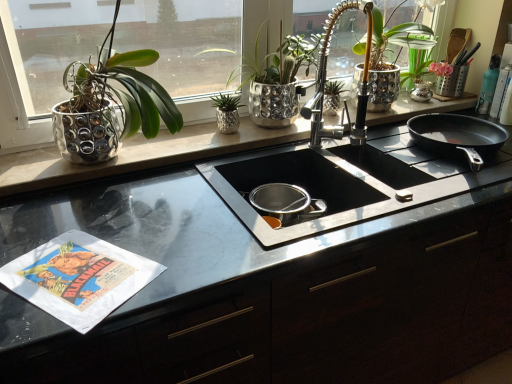
Where is `vacant space in shiny metallic pot at center, marked as the 2th houseplant in a right-to-left arrangement (from a real-world perspective)`? Image resolution: width=512 pixels, height=384 pixels. vacant space in shiny metallic pot at center, marked as the 2th houseplant in a right-to-left arrangement (from a real-world perspective) is located at coordinates (274, 129).